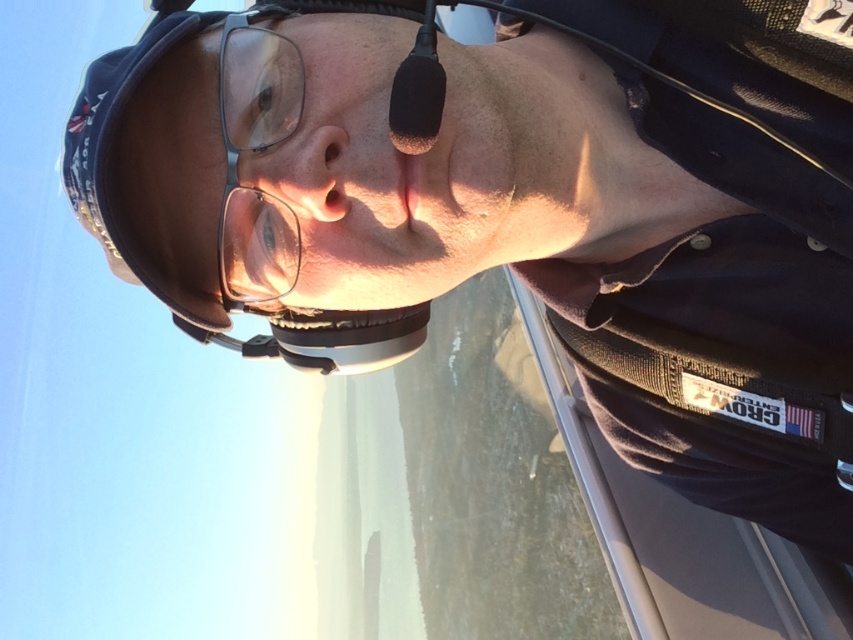
Question: Which of the following is the closest to the observer?

Choices:
 (A) clear plastic glasses at center
 (B) black fabric helmet at left

Answer: (B)

Question: Is black fabric helmet at left above clear plastic glasses at center?

Choices:
 (A) no
 (B) yes

Answer: (A)

Question: Is black fabric helmet at left positioned behind clear plastic glasses at center?

Choices:
 (A) yes
 (B) no

Answer: (B)

Question: Among these points, which one is farthest from the camera?

Choices:
 (A) [x=288, y=76]
 (B) [x=252, y=90]

Answer: (B)

Question: Does black fabric helmet at left have a greater width compared to clear plastic glasses at center?

Choices:
 (A) yes
 (B) no

Answer: (A)